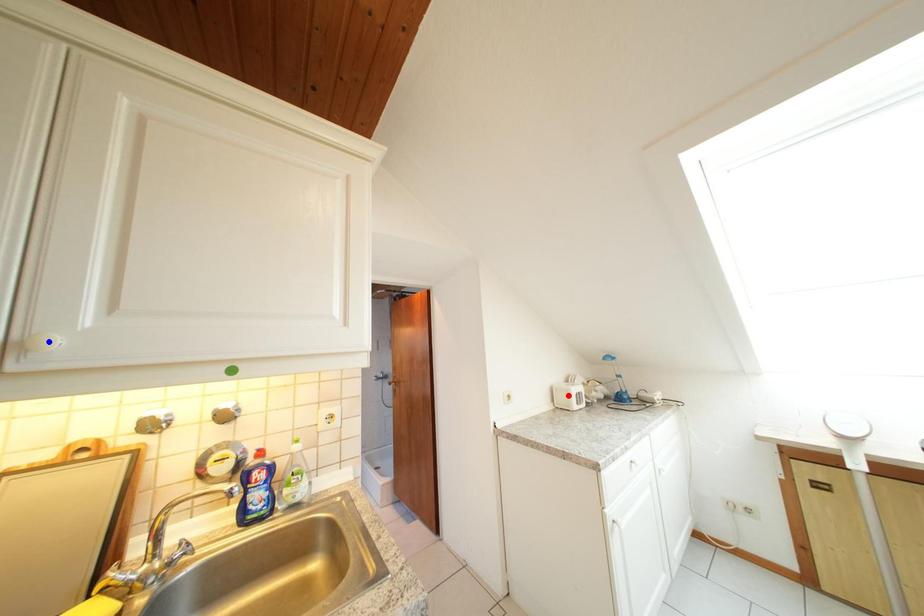
Question: Two points are marked on the image. Which point is closer to the camera?

Choices:
 (A) Blue point is closer.
 (B) Red point is closer.

Answer: (A)